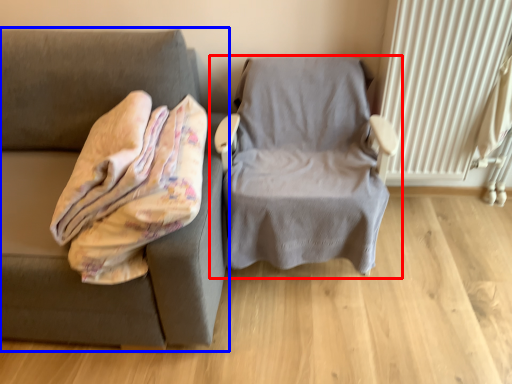
Question: Which of the following is the farthest to the observer, chair (highlighted by a red box) or studio couch (highlighted by a blue box)?

Choices:
 (A) chair
 (B) studio couch

Answer: (A)